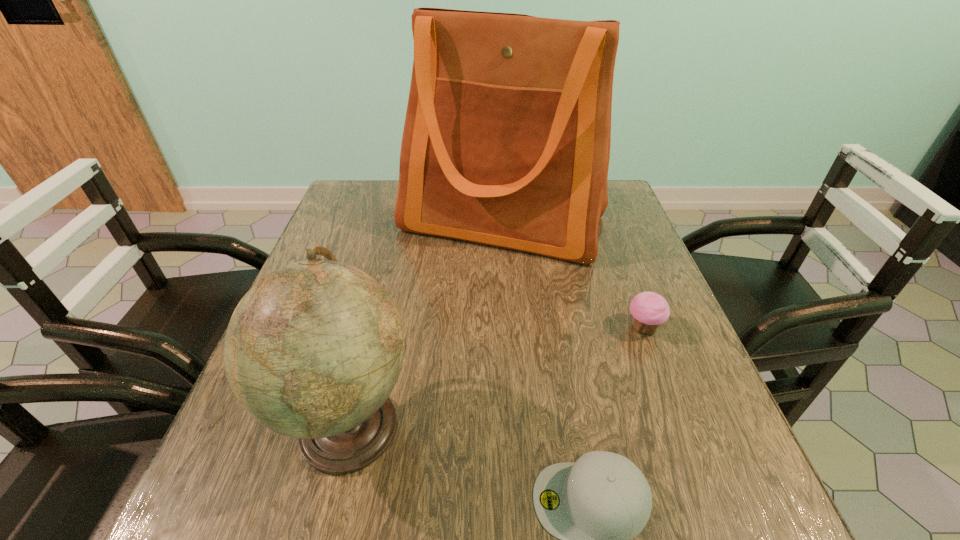
This screenshot has height=540, width=960. Identify the location of object that is at the left edge. (313, 350).

You are a GUI agent. You are given a task and a screenshot of the screen. Output one action in this format:
    pyautogui.click(x=<x>, y=<y>)
    Task: Click on the shopping bag that is at the right edge
    
    Given the screenshot: What is the action you would take?
    pyautogui.click(x=506, y=142)

At what (x,y) coordinates should I click in order to perform the action: click on cupcake at the right edge. Please return your answer as a coordinate pair (x, y). The height and width of the screenshot is (540, 960). Looking at the image, I should click on (649, 310).

Locate an element on the screen. The width and height of the screenshot is (960, 540). object present at the near left corner is located at coordinates (313, 350).

At what (x,y) coordinates should I click in order to perform the action: click on object that is at the far right corner. Please return your answer as a coordinate pair (x, y). The height and width of the screenshot is (540, 960). Looking at the image, I should click on coord(506,142).

Identify the location of free region at the left edge of the desktop. (361, 261).

I want to click on vacant region at the right edge, so click(x=708, y=391).

Identify the location of vacant area at the far left corner of the desktop. (342, 208).

The width and height of the screenshot is (960, 540). I want to click on free space at the near left corner of the desktop, so click(238, 497).

This screenshot has width=960, height=540. In order to click on unoccupied area between the third shortest object and the tallest object in this screenshot , I will do `click(426, 323)`.